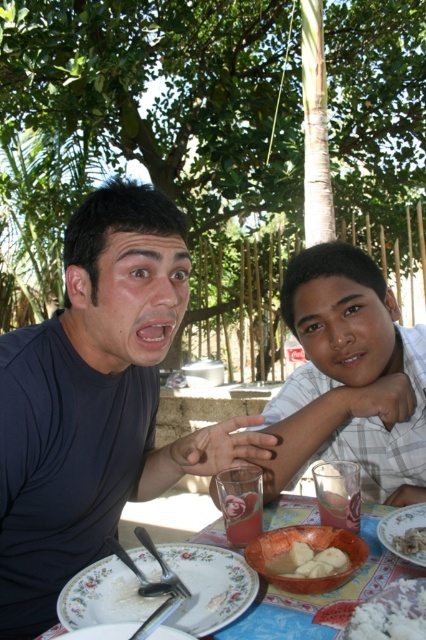
Between point (189, 625) and point (416, 524), which one is positioned behind?

The point (416, 524) is more distant.

Who is taller, floral porcelain plate at lower center or white ceramic plate at lower right?

floral porcelain plate at lower center is taller.

What do you see at coordinates (210, 586) in the screenshot? I see `floral porcelain plate at lower center` at bounding box center [210, 586].

This screenshot has width=426, height=640. What are the coordinates of `floral porcelain plate at lower center` in the screenshot? It's located at tap(210, 586).

Is white fluffy rice at lower right positioned behind white ceramic plate at lower center?

No.

Which is in front, point (397, 595) or point (160, 632)?

Point (160, 632) is in front.

I want to click on white fluffy rice at lower right, so click(x=391, y=612).

Which is more to the right, white ceramic plate at lower right or white creamy rice at lower right?

white ceramic plate at lower right is more to the right.

Does white ceramic plate at lower right have a larger size compared to white creamy rice at lower right?

Yes.

The image size is (426, 640). I want to click on white ceramic plate at lower right, so click(x=402, y=529).